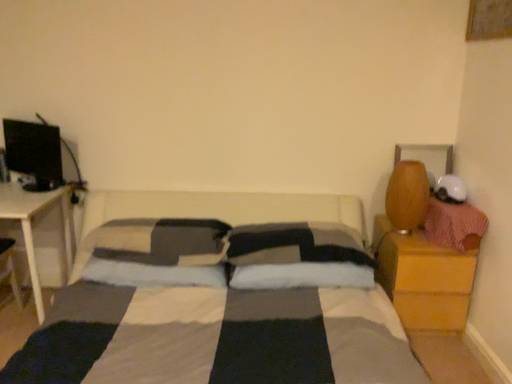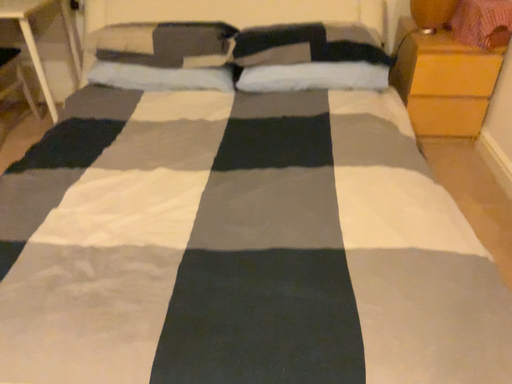
Question: Which way did the camera rotate in the video?

Choices:
 (A) rotated downward
 (B) rotated upward

Answer: (A)